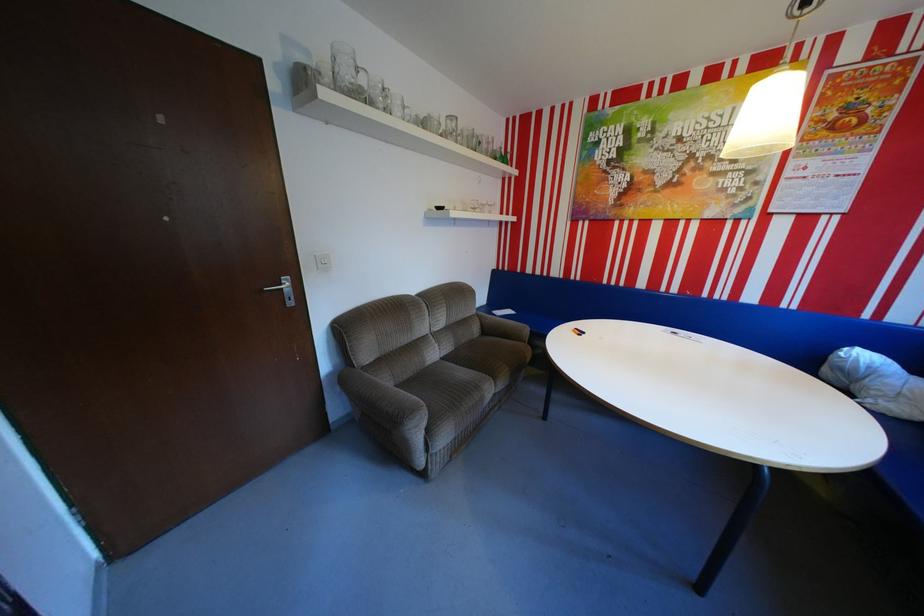
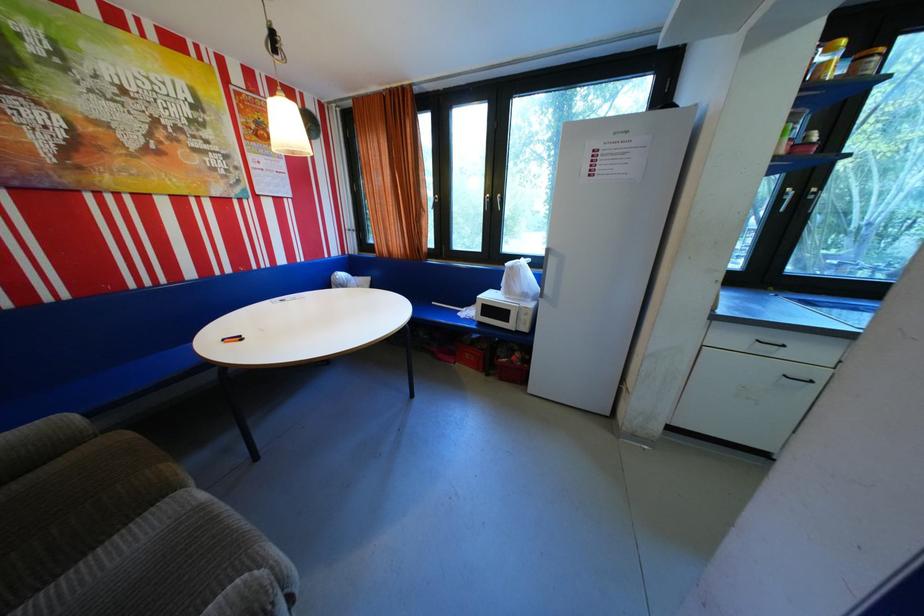
First-person continuous shooting, in which direction is the camera rotating?

The camera's rotation is toward right-down.